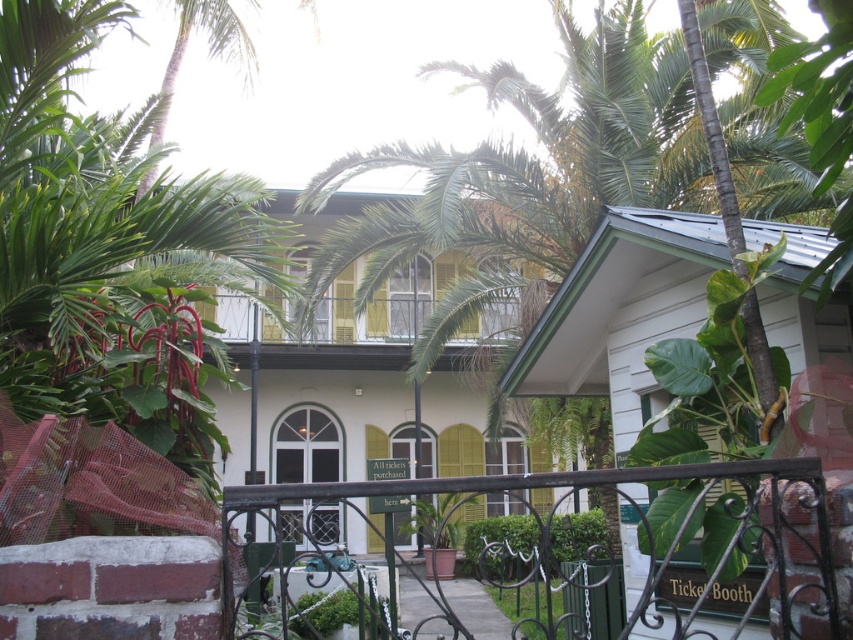
Who is shorter, green wrought iron fence at center or wooden balcony at center?

With less height is wooden balcony at center.

Is point (285, 566) in front of point (396, 355)?

That is True.

Where is `green wrought iron fence at center`? The height and width of the screenshot is (640, 853). green wrought iron fence at center is located at coordinates (611, 484).